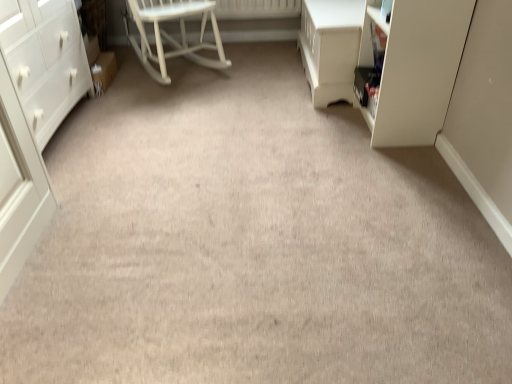
The height and width of the screenshot is (384, 512). Identify the location of vacant space in front of white wood rocking chair at center. (177, 105).